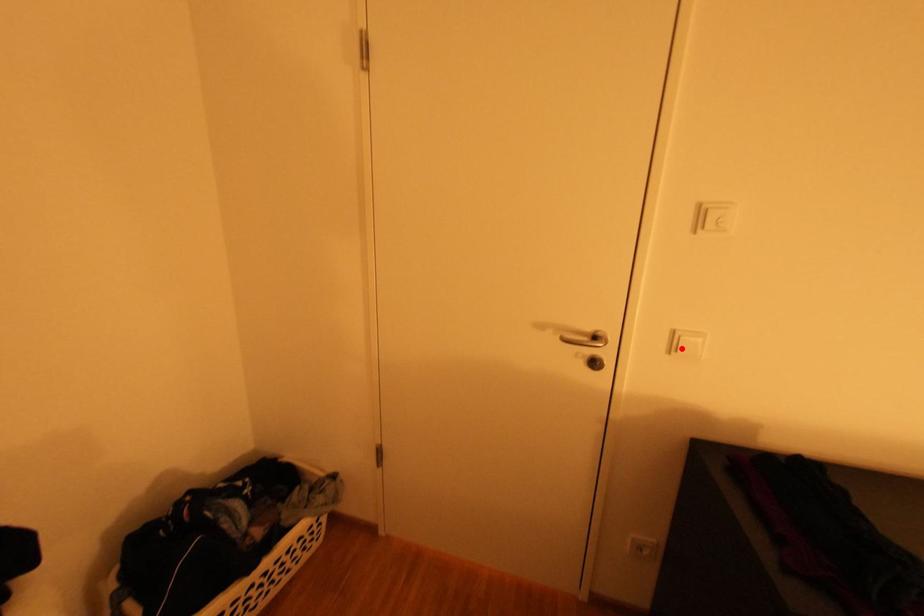
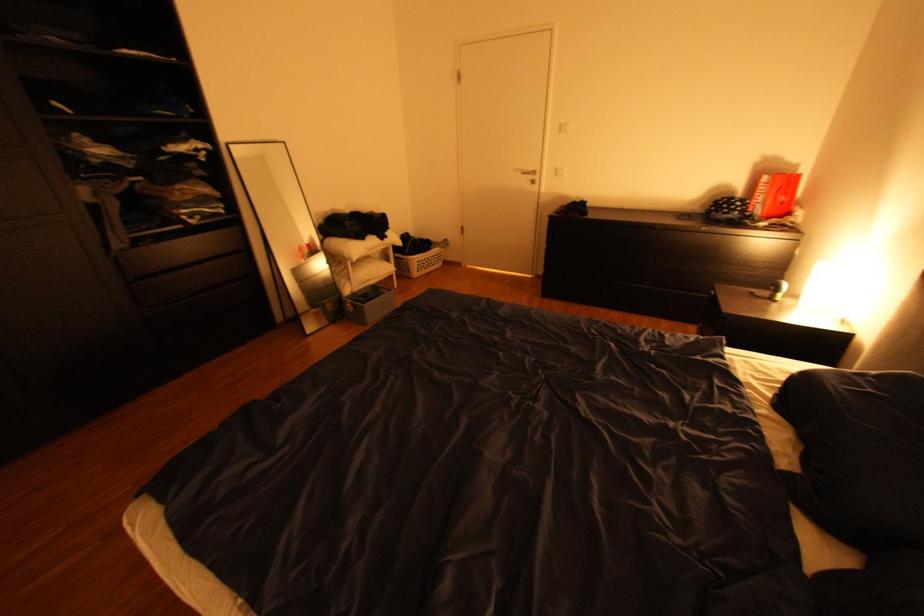
Question: I am providing you with two images of the same scene from different viewpoints. Image1 has a red point marked. In image2, the corresponding 3D location appears at what relative position? Reply with the corresponding letter.

Choices:
 (A) Closer
 (B) Farther

Answer: (A)